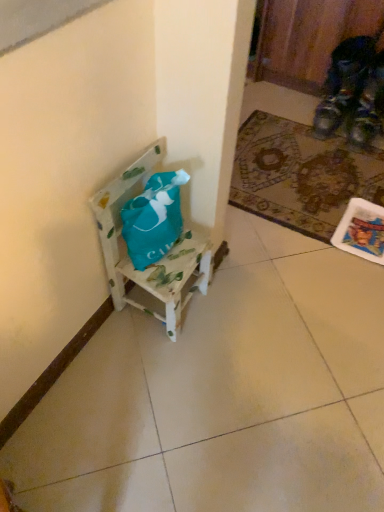
Question: From a real-world perspective, is patterned carpet at lower right above or below wooden painted chair at center?

Choices:
 (A) above
 (B) below

Answer: (B)

Question: Is patterned carpet at lower right spatially inside wooden painted chair at center, or outside of it?

Choices:
 (A) inside
 (B) outside

Answer: (B)

Question: Is patterned carpet at lower right to the left or to the right of wooden painted chair at center in the image?

Choices:
 (A) right
 (B) left

Answer: (A)

Question: Is point [x=119, y=179] closer or farther from the camera than point [x=347, y=165]?

Choices:
 (A) closer
 (B) farther

Answer: (A)

Question: Is wooden painted chair at center in front of or behind patterned carpet at lower right in the image?

Choices:
 (A) behind
 (B) front

Answer: (B)

Question: From the image's perspective, relative to patterned carpet at lower right, is wooden painted chair at center above or below?

Choices:
 (A) above
 (B) below

Answer: (B)

Question: Looking at the image, does wooden painted chair at center seem bigger or smaller compared to patterned carpet at lower right?

Choices:
 (A) small
 (B) big

Answer: (B)